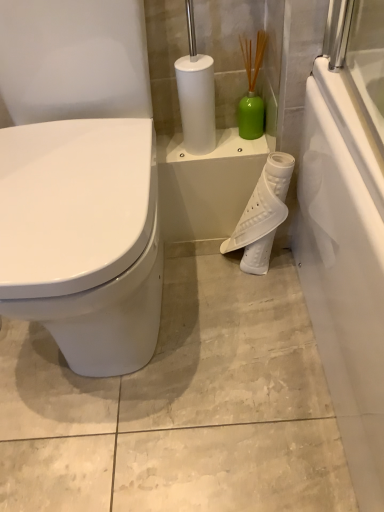
Question: Is white plastic toilet paper at center to the right of white glossy toilet at left from the viewer's perspective?

Choices:
 (A) no
 (B) yes

Answer: (B)

Question: Does white plastic toilet paper at center have a greater width compared to white glossy toilet at left?

Choices:
 (A) no
 (B) yes

Answer: (A)

Question: Is white plastic toilet paper at center turned away from white glossy toilet at left?

Choices:
 (A) no
 (B) yes

Answer: (A)

Question: Does white plastic toilet paper at center lie behind white glossy toilet at left?

Choices:
 (A) yes
 (B) no

Answer: (A)

Question: From a real-world perspective, is white plastic toilet paper at center located beneath white glossy toilet at left?

Choices:
 (A) no
 (B) yes

Answer: (B)

Question: Could you tell me if white plastic toilet paper at center is facing white glossy toilet at left?

Choices:
 (A) no
 (B) yes

Answer: (A)

Question: Does white glossy toilet at left come behind white plastic toilet paper at center?

Choices:
 (A) yes
 (B) no

Answer: (B)

Question: From a real-world perspective, is white glossy toilet at left positioned over white plastic toilet paper at center based on gravity?

Choices:
 (A) no
 (B) yes

Answer: (B)

Question: Can you confirm if white glossy toilet at left is positioned to the left of white plastic toilet paper at center?

Choices:
 (A) no
 (B) yes

Answer: (B)

Question: Is white glossy toilet at left thinner than white plastic toilet paper at center?

Choices:
 (A) yes
 (B) no

Answer: (B)

Question: From the image's perspective, is white glossy toilet at left beneath white plastic toilet paper at center?

Choices:
 (A) no
 (B) yes

Answer: (A)

Question: Is white glossy toilet at left not near white plastic toilet paper at center?

Choices:
 (A) no
 (B) yes

Answer: (A)

Question: Is white glossy toilet at left to the left or to the right of white plastic toilet paper at center in the image?

Choices:
 (A) right
 (B) left

Answer: (B)